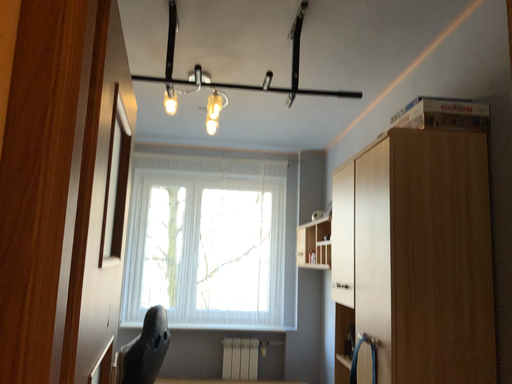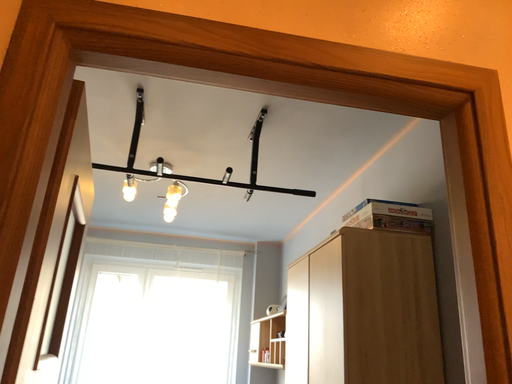
Question: How did the camera likely rotate when shooting the video?

Choices:
 (A) rotated upward
 (B) rotated downward

Answer: (A)